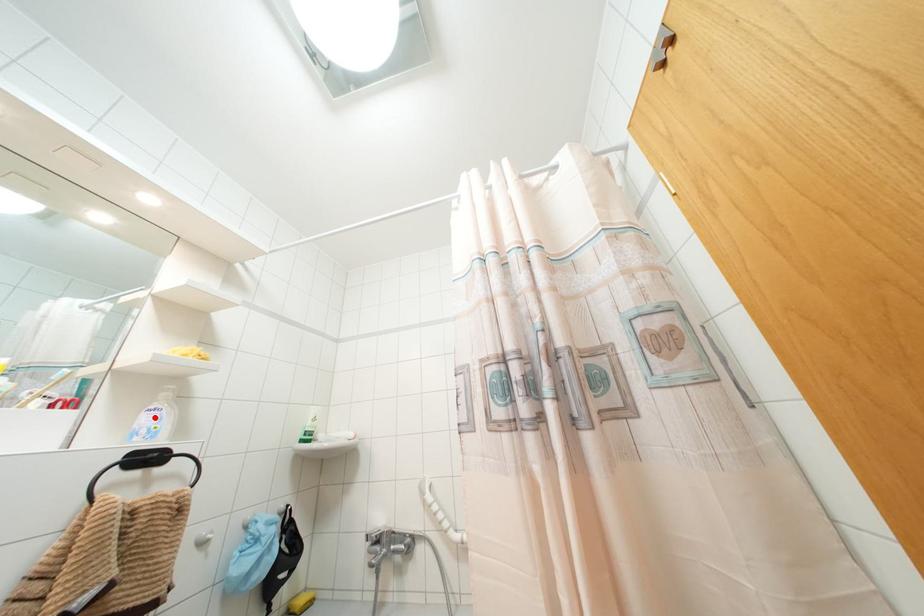
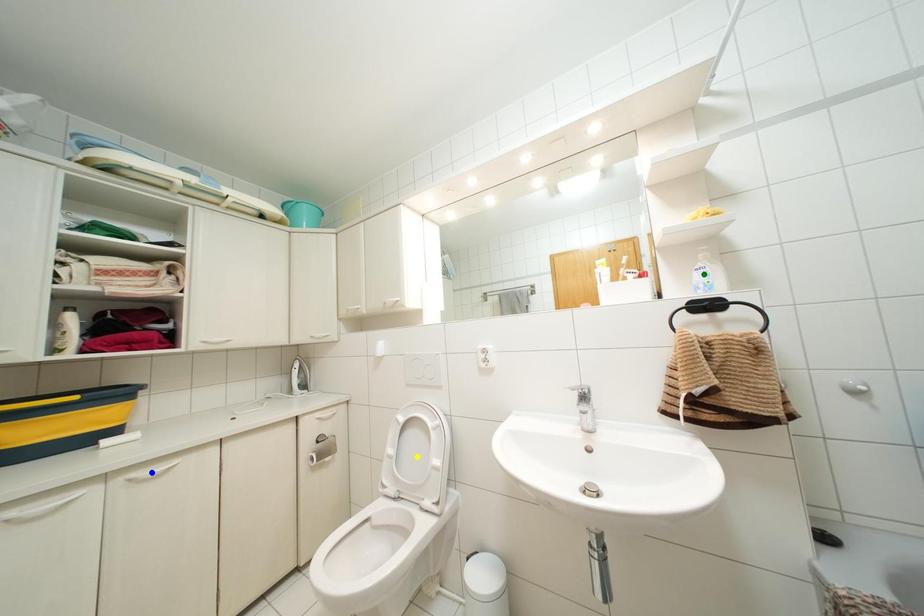
Question: I am providing you with two images of the same scene from different viewpoints. A red point is marked on the first image. You are given multiple points on the second image. Which mark in image 2 goes with the point in image 1?

Choices:
 (A) yellow point
 (B) blue point
 (C) green point

Answer: (C)